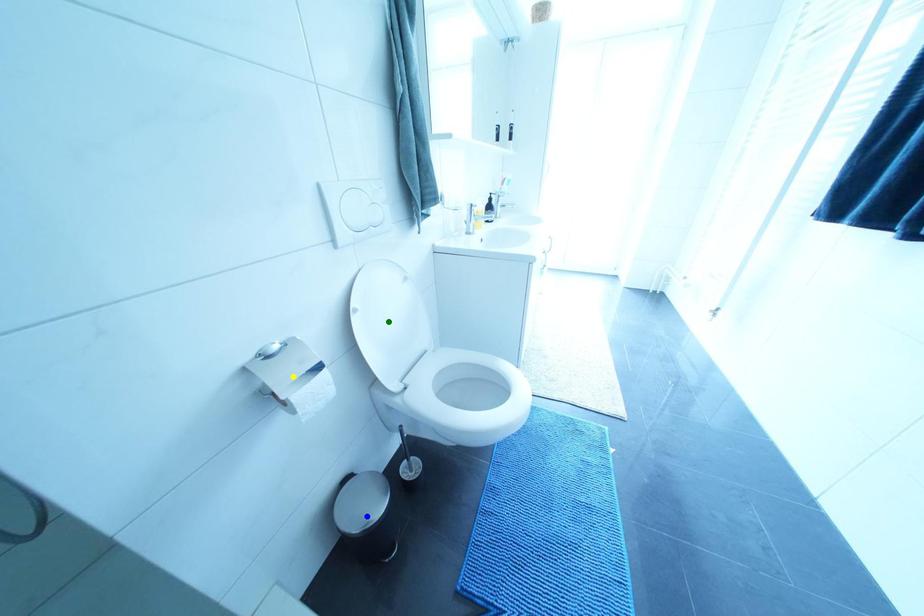
Order these from nearest to farthest:
blue point, yellow point, green point

yellow point < blue point < green point